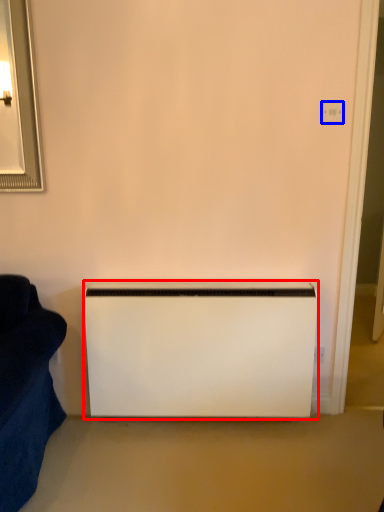
Question: Which of the following is the closest to the observer, appliance (highlighted by a red box) or electric outlet (highlighted by a blue box)?

Choices:
 (A) appliance
 (B) electric outlet

Answer: (B)